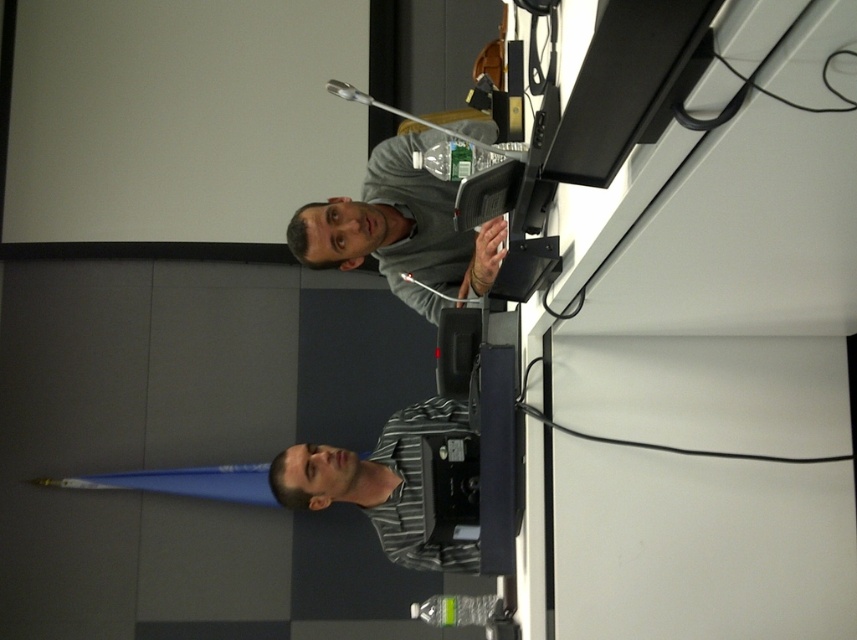
You are organizing a photo shoot in this conference room and need to ensure that the gray matte jacket at upper center and the striped fabric shirt at center are both visible in the frame. Given their widths, which object should be placed closer to the camera to maintain visibility?

The gray matte jacket at upper center has a smaller width than the striped fabric shirt at center. To maintain visibility, the gray matte jacket at upper center should be placed closer to the camera since smaller objects need to be nearer to appear adequately sized in the frame compared to larger ones.

You are an event organizer who needs to arrange seating for a panel discussion. The two speakers are wearing a gray matte jacket at upper center and a striped fabric shirt at center. Based on their current positions in the image, which speaker is closer to the front of the stage?

The striped fabric shirt at center is closer to the front of the stage because the gray matte jacket at upper center has a smaller size compared to striped fabric shirt at center, indicating it is positioned further back.